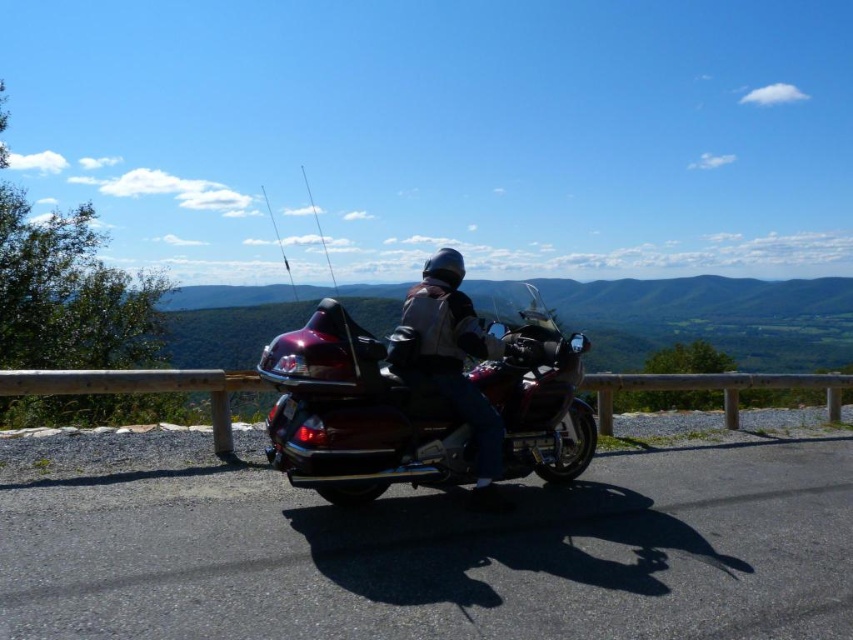
Question: Which object is farther from the camera taking this photo?

Choices:
 (A) metallic silver fishing pole at upper center
 (B) wooden rail at lower center
 (C) metallic red motorcycle at center

Answer: (A)

Question: Can you confirm if metallic burgundy motorcycle at center is wider than wooden rail at lower center?

Choices:
 (A) yes
 (B) no

Answer: (B)

Question: In this image, where is matte black motorcycle at center located relative to metallic fishing pole at upper center?

Choices:
 (A) left
 (B) right

Answer: (B)

Question: Is matte black motorcycle at center to the right of metallic silver fishing pole at upper center from the viewer's perspective?

Choices:
 (A) yes
 (B) no

Answer: (A)

Question: Which of the following is the farthest from the observer?

Choices:
 (A) (434, 353)
 (B) (281, 392)
 (C) (291, 285)
 (D) (222, 454)

Answer: (C)

Question: Which object is the farthest from the metallic red motorcycle at center?

Choices:
 (A) wooden rail at lower center
 (B) metallic fishing pole at upper center

Answer: (B)